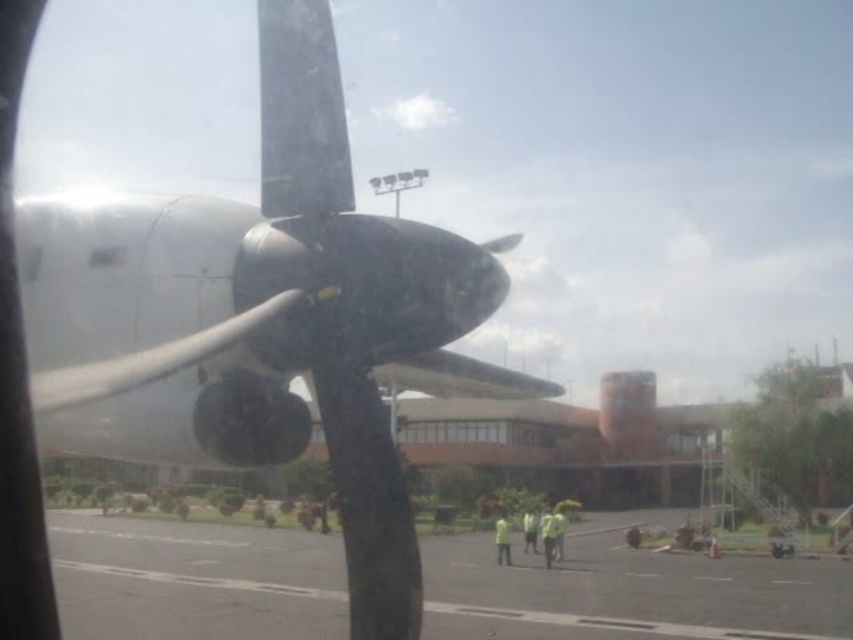
Can you confirm if polished silver propeller at center is thinner than gray asphalt tarmac at lower center?

Indeed, polished silver propeller at center has a lesser width compared to gray asphalt tarmac at lower center.

Does point (339, 237) lie in front of point (746, 588)?

Yes, point (339, 237) is in front of point (746, 588).

Does point (415, 266) come closer to viewer compared to point (149, 628)?

Yes.

What are the coordinates of `polished silver propeller at center` in the screenshot? It's located at (254, 310).